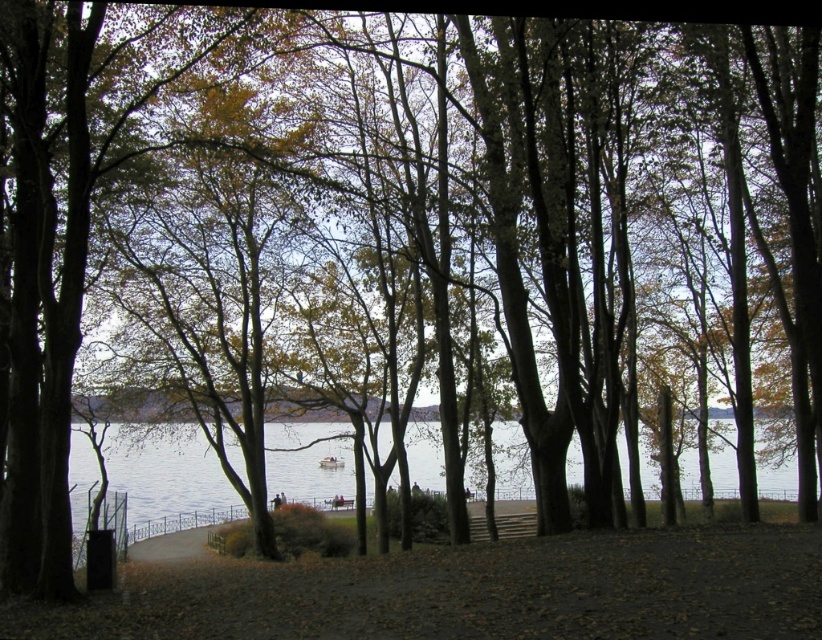
You are standing at the point marked by the coordinates point (165, 474). Looking around, you notice clear water at center. Which direction should you move to reach the clear water at center?

The point (165, 474) is already at the clear water at center, so you are already there.

In the scene shown: You are a photographer planning to take a picture of the white plastic boat at center and the clear water at center. Based on their positions, which object should you place on the left side of your photo?

The white plastic boat at center should be placed on the left side of your photo because the clear water at center is to the right of the boat.

You are a photographer planning to capture the reflection of the white plastic boat at center in the clear water at center. Based on the scene description, will the reflection of the boat be fully visible in the water?

The clear water at center has a larger size compared to white plastic boat at center, so the reflection of the white plastic boat at center should be fully visible in the clear water at center since the water area is bigger than the boat.